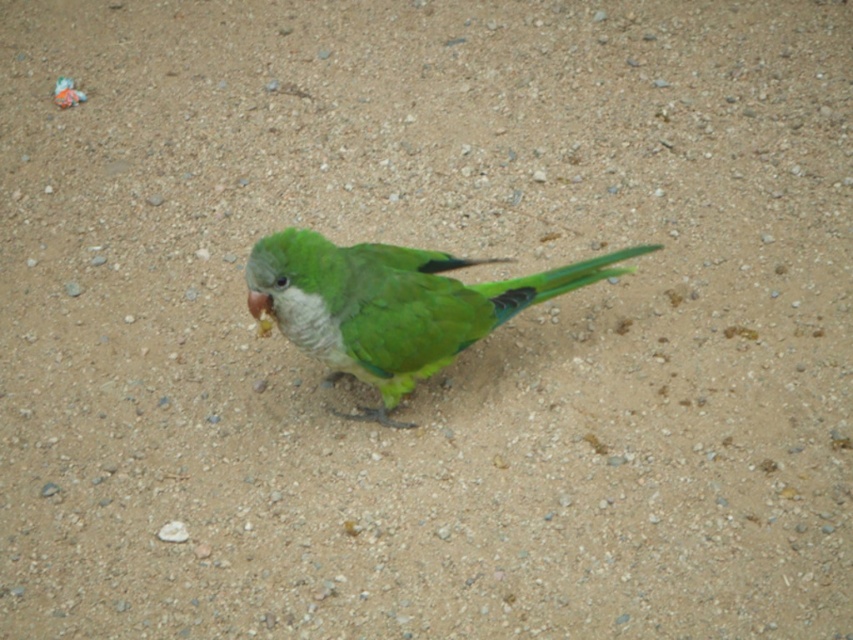
You are a birdwatcher observing the green matte parrot at center and the matte yellow beak at center. Which object is larger in size?

The green matte parrot at center is bigger than the matte yellow beak at center.